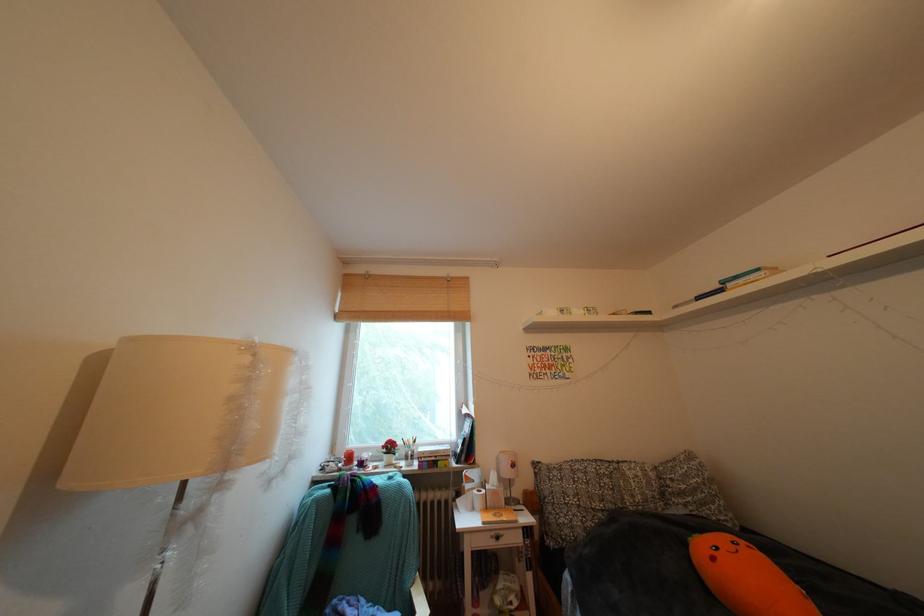
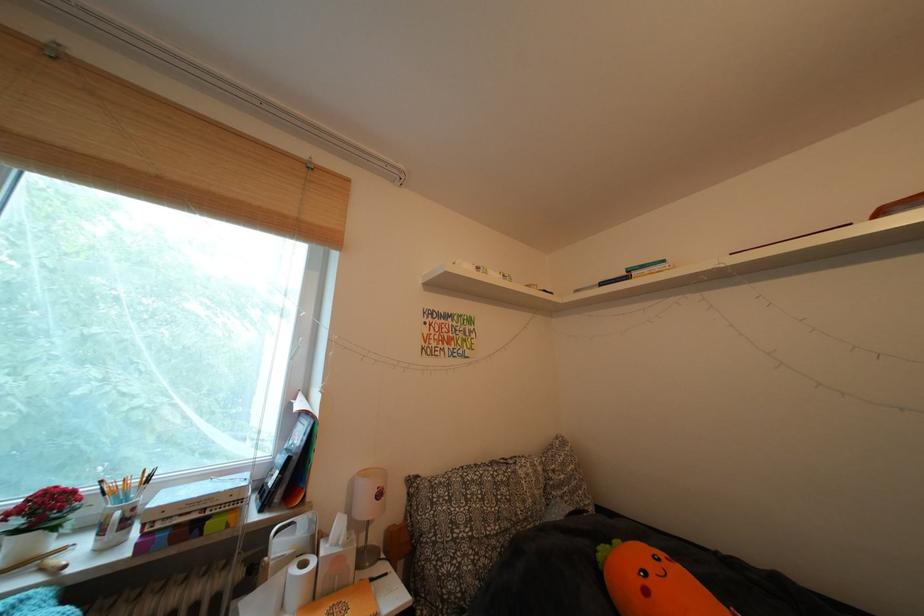
Where in the second image is the point corresponding to point (723, 564) from the first image?

(657, 597)